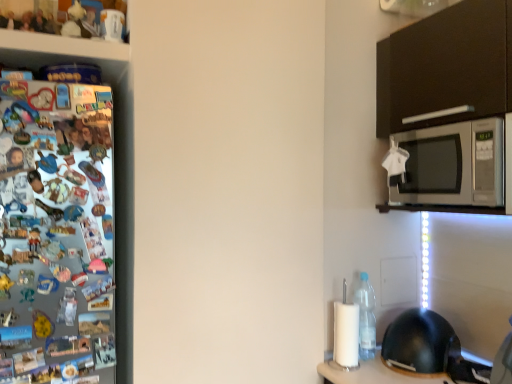
Question: Is silver metallic microwave at upper right oriented away from black matte helmet at lower right?

Choices:
 (A) no
 (B) yes

Answer: (A)

Question: Is silver metallic microwave at upper right wider than black matte helmet at lower right?

Choices:
 (A) no
 (B) yes

Answer: (B)

Question: From the image's perspective, is silver metallic microwave at upper right above black matte helmet at lower right?

Choices:
 (A) no
 (B) yes

Answer: (B)

Question: Does silver metallic microwave at upper right have a larger size compared to black matte helmet at lower right?

Choices:
 (A) yes
 (B) no

Answer: (A)

Question: From the image's perspective, does silver metallic microwave at upper right appear lower than black matte helmet at lower right?

Choices:
 (A) yes
 (B) no

Answer: (B)

Question: From a real-world perspective, is silver metallic microwave at upper right physically located above or below black matte helmet at lower right?

Choices:
 (A) below
 (B) above

Answer: (B)

Question: Would you say silver metallic microwave at upper right is to the left or to the right of black matte helmet at lower right in the picture?

Choices:
 (A) right
 (B) left

Answer: (A)

Question: Looking at their shapes, would you say silver metallic microwave at upper right is wider or thinner than black matte helmet at lower right?

Choices:
 (A) thin
 (B) wide

Answer: (B)

Question: From the image's perspective, is silver metallic microwave at upper right above or below black matte helmet at lower right?

Choices:
 (A) below
 (B) above

Answer: (B)

Question: In terms of size, does black matte helmet at lower right appear bigger or smaller than clear plastic bottle at lower right?

Choices:
 (A) small
 (B) big

Answer: (B)

Question: Is point (455, 349) closer or farther from the camera than point (371, 319)?

Choices:
 (A) closer
 (B) farther

Answer: (A)

Question: Would you say black matte helmet at lower right is to the left or to the right of clear plastic bottle at lower right in the picture?

Choices:
 (A) left
 (B) right

Answer: (B)

Question: From the image's perspective, relative to clear plastic bottle at lower right, is black matte helmet at lower right above or below?

Choices:
 (A) below
 (B) above

Answer: (A)

Question: Do you think black matte helmet at lower right is within silver metallic microwave at upper right, or outside of it?

Choices:
 (A) outside
 (B) inside

Answer: (A)

Question: From the image's perspective, is black matte helmet at lower right above or below silver metallic microwave at upper right?

Choices:
 (A) below
 (B) above

Answer: (A)